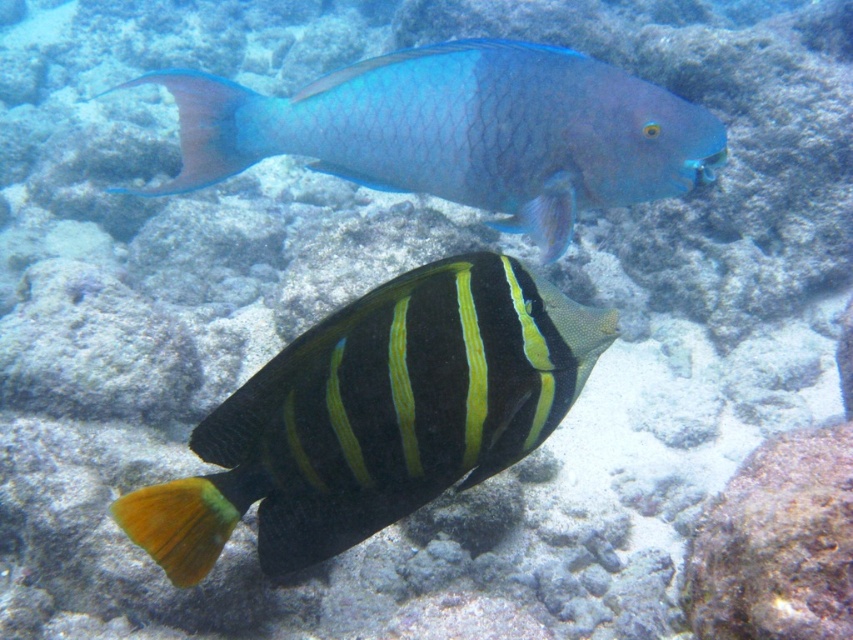
Between point (476, 461) and point (442, 177), which one is positioned behind?

Point (442, 177)

From the picture: Who is positioned more to the right, shiny black and yellow fish at center or shiny blue parrotfish at upper center?

shiny blue parrotfish at upper center is more to the right.

Where is `shiny black and yellow fish at center`? shiny black and yellow fish at center is located at coordinates (376, 416).